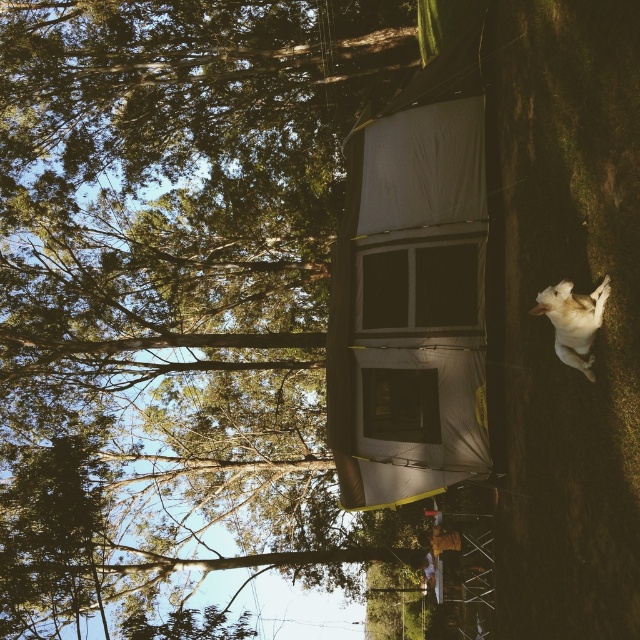
You are a hiker who wants to take a photo of the white fur dog at lower right without the green leafy tree at upper center blocking the view. Based on their sizes, is this possible?

The green leafy tree at upper center is taller than the white fur dog at lower right, so it might block the view depending on their positions. However, since the tree is at upper center and the dog is at lower right, you can position yourself lower to avoid the tree blocking the view.